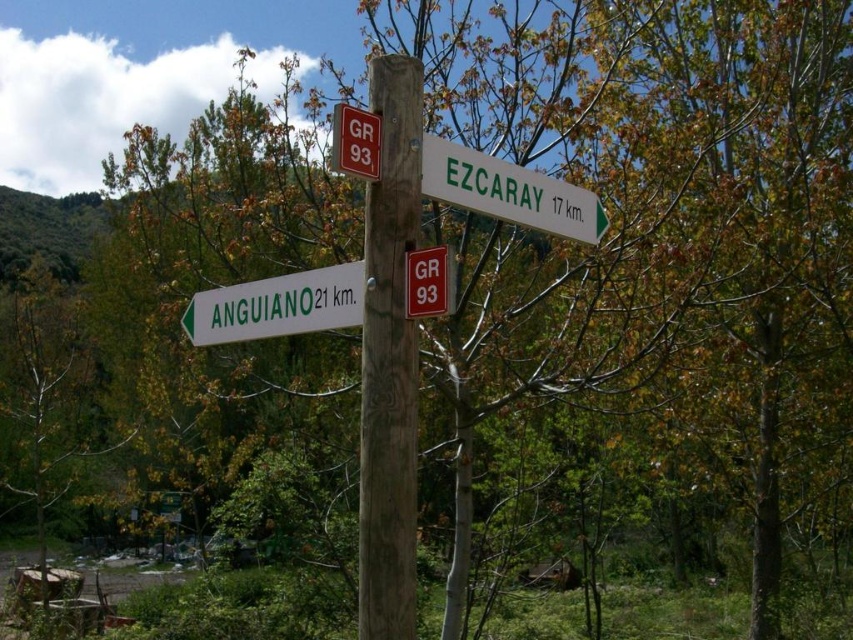
Question: Where is wooden post at center located in relation to green plastic sign at upper center in the image?

Choices:
 (A) right
 (B) left

Answer: (B)

Question: Based on their relative distances, which object is farther from the white plastic sign at lower left?

Choices:
 (A) red plastic sign at upper center
 (B) red plastic sign at center

Answer: (A)

Question: Which object is positioned closest to the red plastic sign at center?

Choices:
 (A) green plastic sign at upper center
 (B) wooden post at center
 (C) red plastic sign at upper center

Answer: (B)

Question: Which point is closer to the camera?

Choices:
 (A) coord(433,312)
 (B) coord(364,129)
 (C) coord(577,189)

Answer: (A)

Question: Is green plastic sign at upper center smaller than red plastic sign at center?

Choices:
 (A) no
 (B) yes

Answer: (A)

Question: Is red plastic sign at center smaller than red plastic sign at upper center?

Choices:
 (A) yes
 (B) no

Answer: (A)